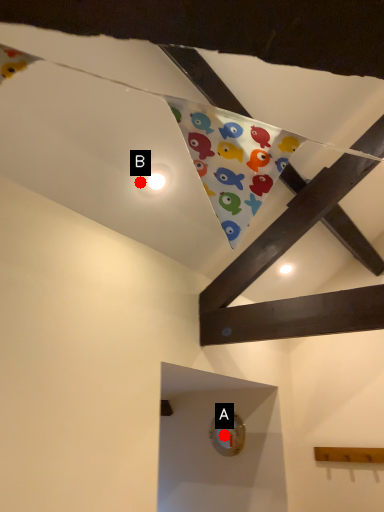
Question: Two points are circled on the image, labeled by A and B beside each circle. Among these points, which one is nearest to the camera?

Choices:
 (A) A is closer
 (B) B is closer

Answer: (B)